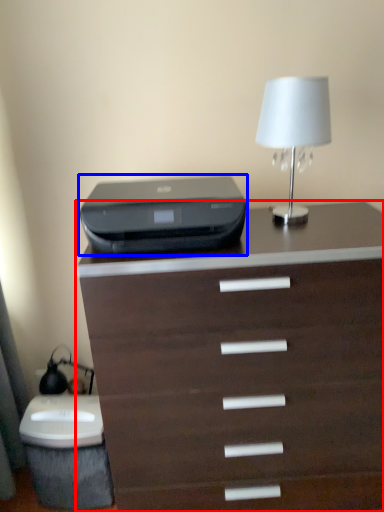
Question: Which point is closer to the camera, chest of drawers (highlighted by a red box) or printer (highlighted by a blue box)?

Choices:
 (A) chest of drawers
 (B) printer

Answer: (A)